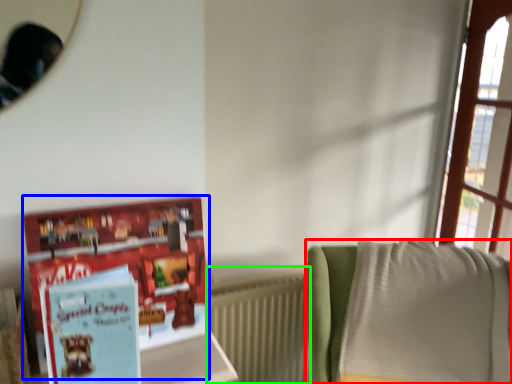
Question: Estimate the real-world distances between objects in this image. Which object is farther from furniture (highlighted by a red box), book (highlighted by a blue box) or radiator (highlighted by a green box)?

Choices:
 (A) book
 (B) radiator

Answer: (A)